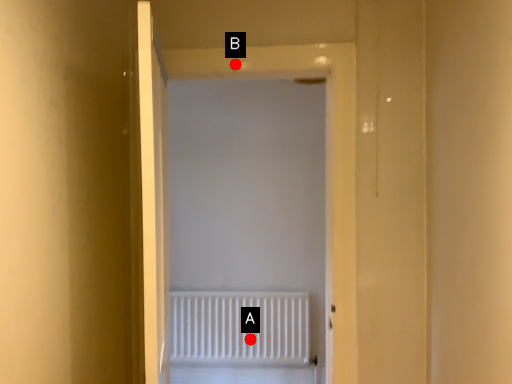
Question: Two points are circled on the image, labeled by A and B beside each circle. Among these points, which one is nearest to the camera?

Choices:
 (A) A is closer
 (B) B is closer

Answer: (B)